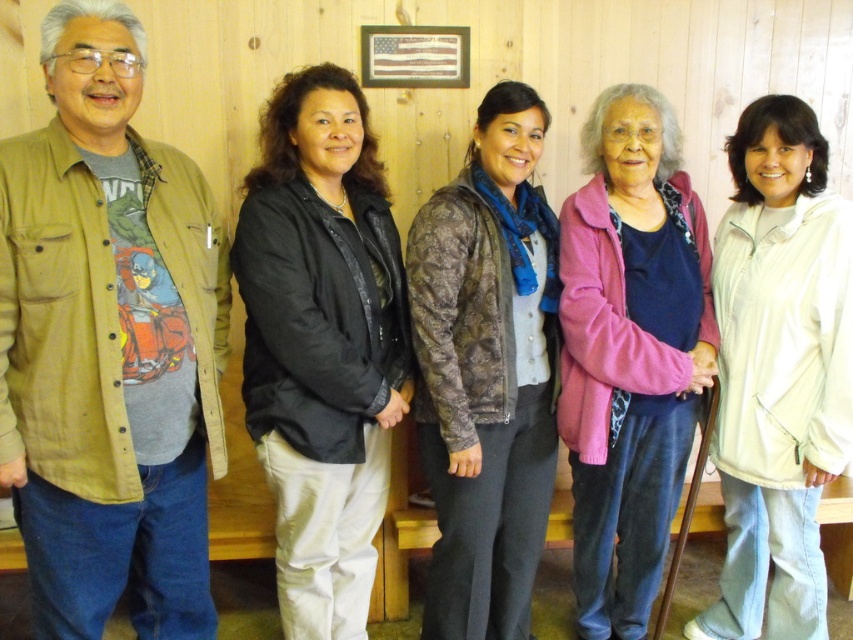
You are organizing a clothing donation drive and need to decide which jacket to place in a smaller donation box. Which jacket between the brown quilted jacket at center and the pink fabric jacket at center would fit better in the box?

The brown quilted jacket at center is thinner than the pink fabric jacket at center, so it would fit better in the smaller donation box.

You are standing at the origin point in the image. Which of the two points, point (286,634) or point (770,310), is farther away from you?

Point (286,634) is behind point (770,310), so it is farther away from you.